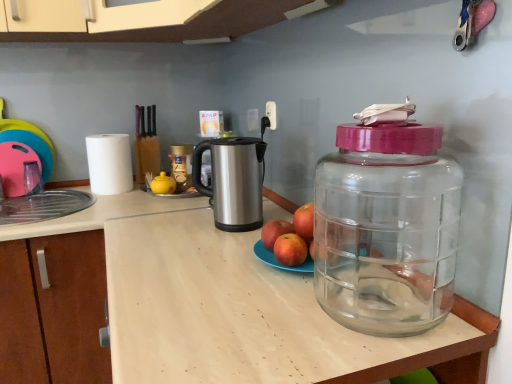
Where is `free space above light wood at center, the 1th counter top from the back (from a real-world perspective)`? The width and height of the screenshot is (512, 384). free space above light wood at center, the 1th counter top from the back (from a real-world perspective) is located at coordinates (84, 201).